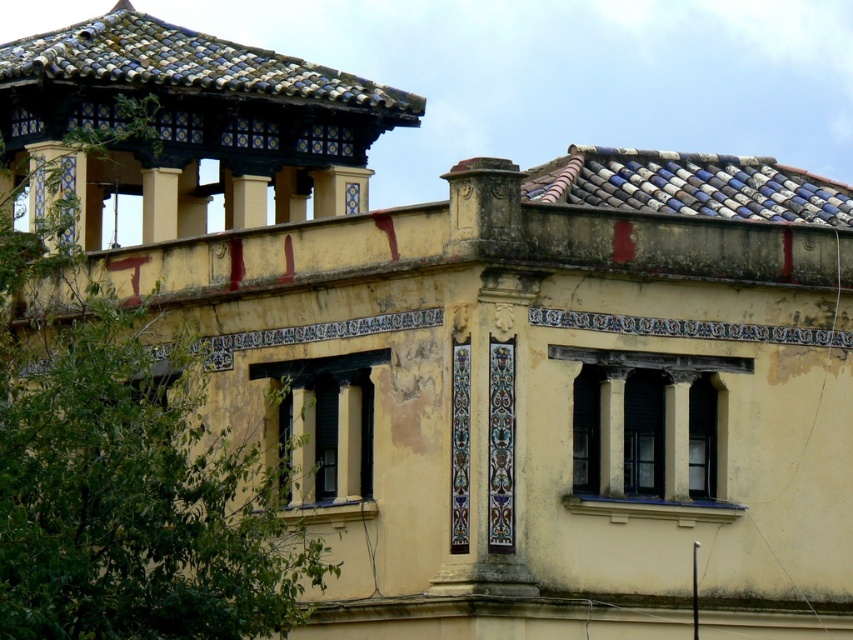
Question: Which point appears farthest from the camera in this image?

Choices:
 (A) (195, 52)
 (B) (849, 220)

Answer: (A)

Question: Can you confirm if blue and white tiled roof at upper left is positioned above blue and white glazed tiles at upper right?

Choices:
 (A) yes
 (B) no

Answer: (A)

Question: Which of the following is the farthest from the observer?

Choices:
 (A) (838, 225)
 (B) (416, 124)

Answer: (B)

Question: Is blue and white tiled roof at upper left bigger than blue and white glazed tiles at upper right?

Choices:
 (A) yes
 (B) no

Answer: (A)

Question: Observing the image, what is the correct spatial positioning of blue and white tiled roof at upper left in reference to blue and white glazed tiles at upper right?

Choices:
 (A) left
 (B) right

Answer: (A)